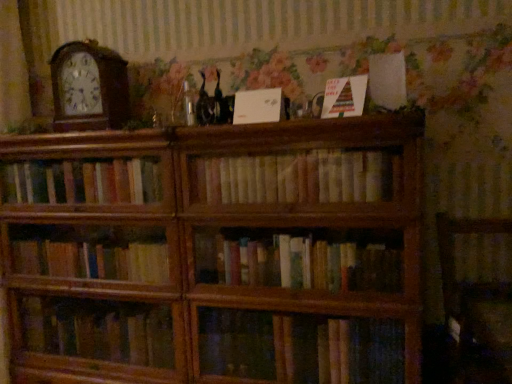
Question: Is light brown wood bookshelf at center bigger than white matte paper at upper center, which is counted as the 2th paperback book, starting from the right?

Choices:
 (A) no
 (B) yes

Answer: (B)

Question: Does light brown wood bookshelf at center touch white matte paper at upper center, which is counted as the 2th paperback book, starting from the right?

Choices:
 (A) no
 (B) yes

Answer: (A)

Question: Is light brown wood bookshelf at center to the left of white matte paper at upper center, which is counted as the 2th paperback book, starting from the right, from the viewer's perspective?

Choices:
 (A) yes
 (B) no

Answer: (B)

Question: Can you confirm if light brown wood bookshelf at center is taller than white matte paper at upper center, which is counted as the 2th paperback book, starting from the right?

Choices:
 (A) no
 (B) yes

Answer: (B)

Question: From the image's perspective, does light brown wood bookshelf at center appear lower than white matte paper at upper center, which is counted as the 2th paperback book, starting from the right?

Choices:
 (A) yes
 (B) no

Answer: (A)

Question: From a real-world perspective, is light brown wood bookshelf at center on white matte paper at upper center, which is counted as the 2th paperback book, starting from the right?

Choices:
 (A) yes
 (B) no

Answer: (B)

Question: Considering the relative sizes of white matte paper at upper center, the first paperback book in the left-to-right sequence, and wooden bookcase at center in the image provided, is white matte paper at upper center, the first paperback book in the left-to-right sequence, bigger than wooden bookcase at center?

Choices:
 (A) no
 (B) yes

Answer: (A)

Question: Can you confirm if white matte paper at upper center, which is counted as the 2th paperback book, starting from the right, is smaller than wooden bookcase at center?

Choices:
 (A) no
 (B) yes

Answer: (B)

Question: Is white matte paper at upper center, the first paperback book in the left-to-right sequence, far away from wooden bookcase at center?

Choices:
 (A) yes
 (B) no

Answer: (B)

Question: Is the position of white matte paper at upper center, the first paperback book in the left-to-right sequence, more distant than that of wooden bookcase at center?

Choices:
 (A) no
 (B) yes

Answer: (B)

Question: From the image's perspective, would you say white matte paper at upper center, which is counted as the 2th paperback book, starting from the right, is shown under wooden bookcase at center?

Choices:
 (A) yes
 (B) no

Answer: (B)

Question: Does white matte paper at upper center, which is counted as the 2th paperback book, starting from the right, touch wooden bookcase at center?

Choices:
 (A) no
 (B) yes

Answer: (A)

Question: Is multicolored paper at upper center, arranged as the first paperback book when viewed from the right, thinner than wooden bookcase at center?

Choices:
 (A) no
 (B) yes

Answer: (B)